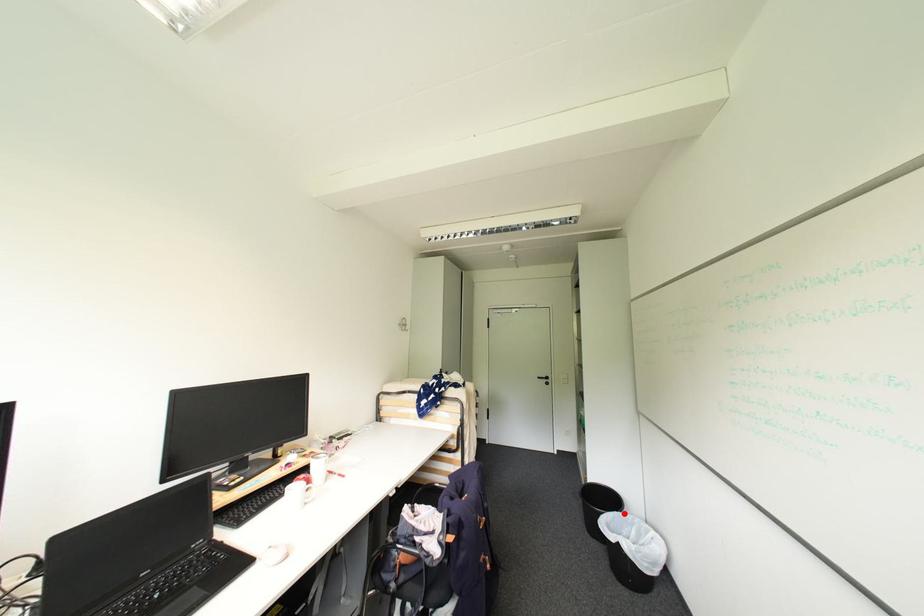
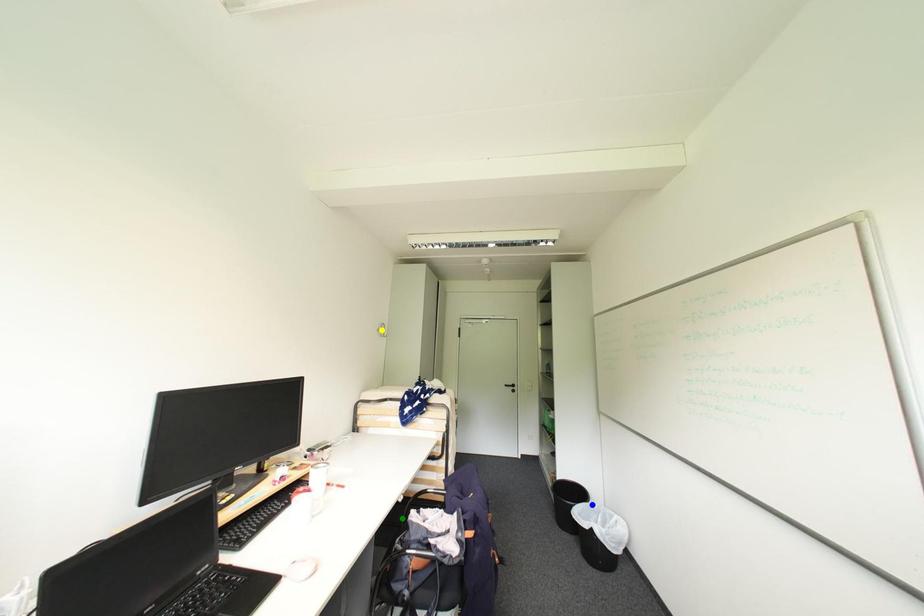
Question: I am providing you with two images of the same scene from different viewpoints. A red point is marked on the first image. You are given multiple points on the second image. Which point in image 2 represents the same 3d spot as the red point in image 1?

Choices:
 (A) green point
 (B) yellow point
 (C) blue point

Answer: (C)